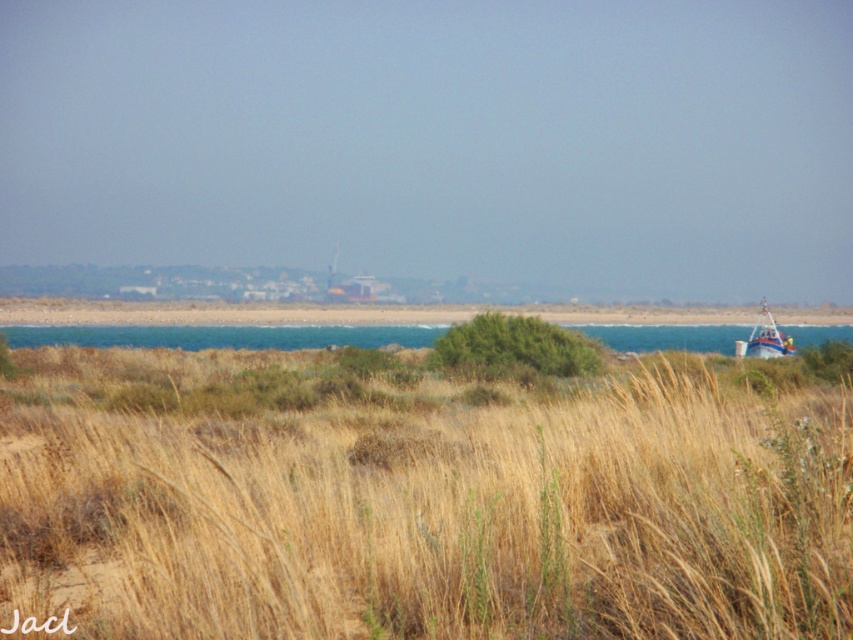
Question: Estimate the real-world distances between objects in this image. Which object is farther from the dry grass at center?

Choices:
 (A) blue water at lower right
 (B) white plastic boat at right

Answer: (B)

Question: Can you confirm if dry grass at center is positioned below white plastic boat at right?

Choices:
 (A) yes
 (B) no

Answer: (A)

Question: Can you confirm if dry grass at center is bigger than blue water at lower right?

Choices:
 (A) no
 (B) yes

Answer: (A)

Question: Which of the following is the farthest from the observer?

Choices:
 (A) dry grass at center
 (B) white plastic boat at right
 (C) blue water at lower right

Answer: (B)

Question: Which of the following is the farthest from the observer?

Choices:
 (A) dry grass at center
 (B) white plastic boat at right

Answer: (B)

Question: Does dry grass at center appear on the right side of blue water at lower right?

Choices:
 (A) yes
 (B) no

Answer: (B)